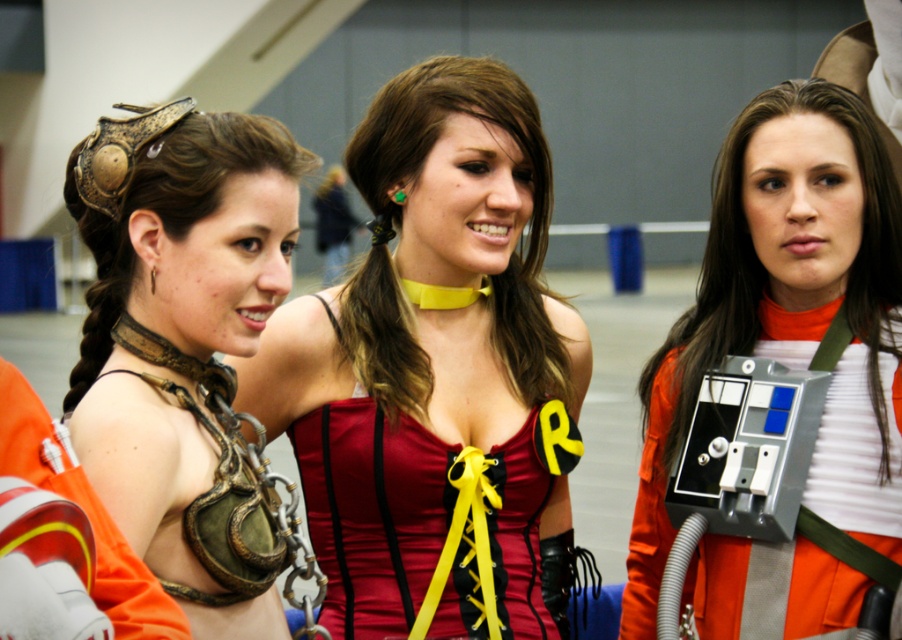
Question: Is shiny red corset at center above metallic chainmail at left?

Choices:
 (A) yes
 (B) no

Answer: (A)

Question: In this image, where is gold metallic armor at left located relative to satin red corset at center?

Choices:
 (A) above
 (B) below

Answer: (A)

Question: Which of these objects is positioned closest to the metallic chainmail at left?

Choices:
 (A) orange fabric spacesuit at center
 (B) shiny red corset at center
 (C) matte yellow choker at center

Answer: (B)

Question: Which object appears farthest from the camera in this image?

Choices:
 (A) matte yellow choker at center
 (B) metallic chainmail at left

Answer: (A)

Question: Does gold metallic armor at left come behind matte yellow choker at center?

Choices:
 (A) no
 (B) yes

Answer: (A)

Question: Which of the following is the closest to the observer?

Choices:
 (A) gold metallic armor at left
 (B) matte yellow choker at center
 (C) shiny red corset at center

Answer: (A)